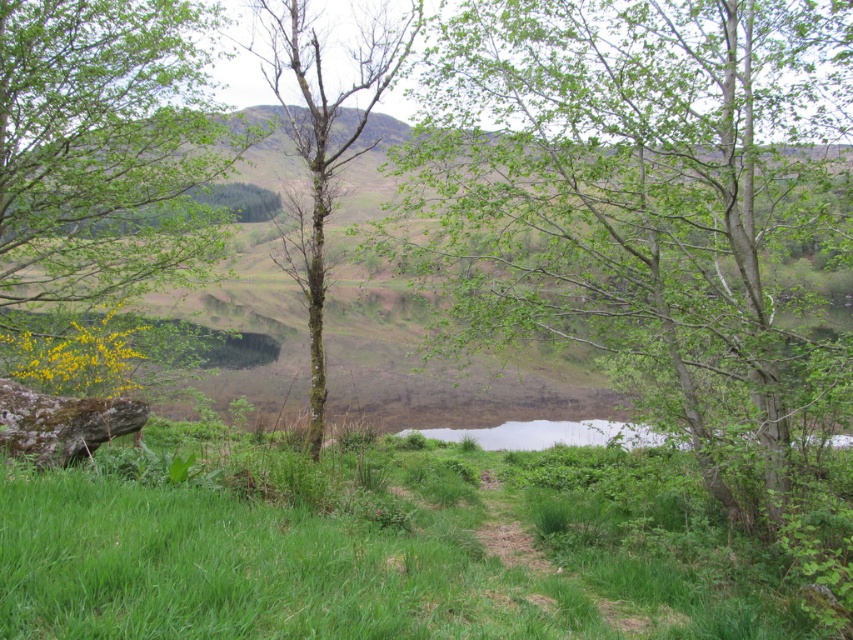
You are a gardener who wants to plant a new flower bed. You have two options for locations in the scene described. The first option is near the green grassy at center, and the second is near the green leafy tree at left. Considering the height of the existing plants, which location might provide more sunlight for the new flowers?

The green grassy at center has a greater height compared to the green leafy tree at left. Therefore, planting near the green leafy tree at left would likely provide more sunlight for the new flowers since the tree is shorter and less likely to cast heavy shade.